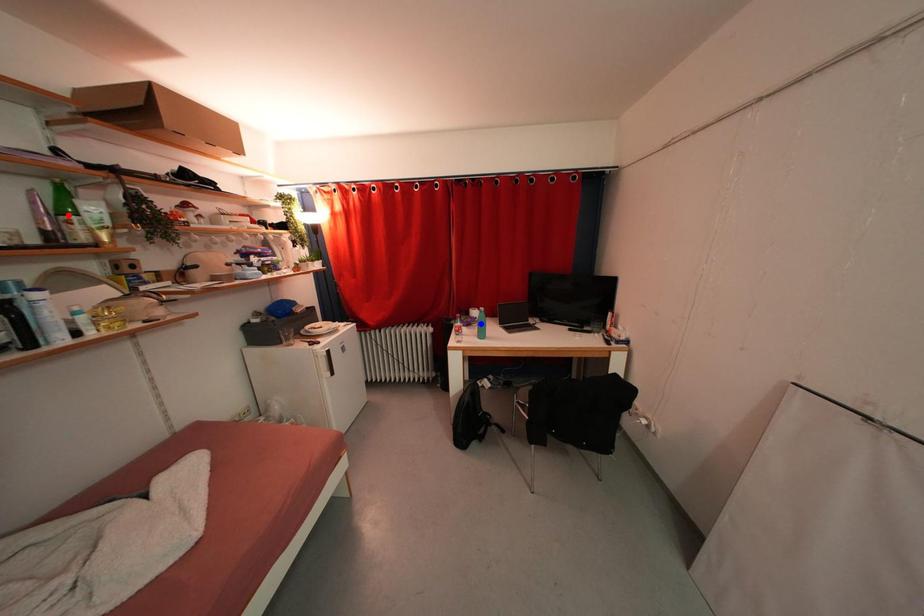
Question: Two points are marked on the image. Which point is closer to the camera?

Choices:
 (A) Blue point is closer.
 (B) Red point is closer.

Answer: (B)